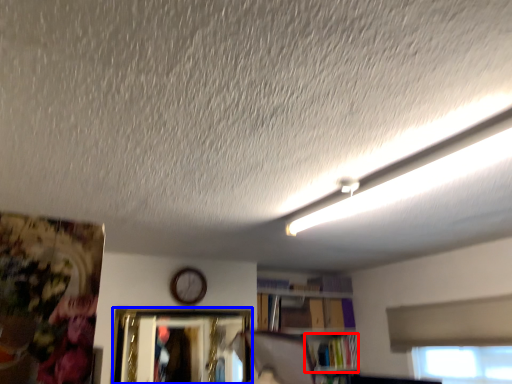
Question: Which object appears farthest to the camera in this image, book (highlighted by a red box) or picture frame (highlighted by a blue box)?

Choices:
 (A) book
 (B) picture frame

Answer: (A)